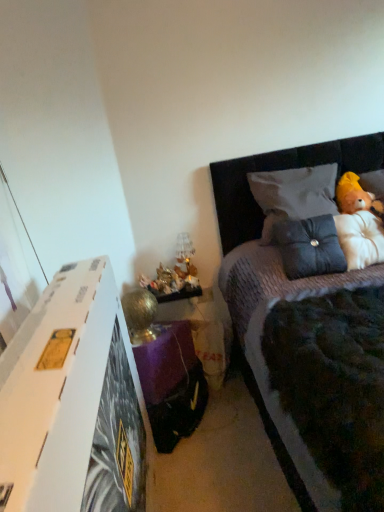
Question: From the image's perspective, is translucent glass lamp at lower center located beneath suede-like black pillow at upper right, which ranks as the second pillow in top-to-bottom order?

Choices:
 (A) yes
 (B) no

Answer: (A)

Question: Considering the relative sizes of translucent glass lamp at lower center and suede-like black pillow at upper right, which ranks as the second pillow in top-to-bottom order, in the image provided, is translucent glass lamp at lower center smaller than suede-like black pillow at upper right, which ranks as the second pillow in top-to-bottom order,?

Choices:
 (A) no
 (B) yes

Answer: (B)

Question: Does translucent glass lamp at lower center appear on the left side of suede-like black pillow at upper right, which ranks as the second pillow in top-to-bottom order?

Choices:
 (A) yes
 (B) no

Answer: (A)

Question: Can you confirm if translucent glass lamp at lower center is shorter than suede-like black pillow at upper right, which ranks as the second pillow in top-to-bottom order?

Choices:
 (A) yes
 (B) no

Answer: (A)

Question: Considering the relative sizes of translucent glass lamp at lower center and suede-like black pillow at upper right, positioned as the 1th pillow in bottom-to-top order, in the image provided, is translucent glass lamp at lower center wider than suede-like black pillow at upper right, positioned as the 1th pillow in bottom-to-top order,?

Choices:
 (A) yes
 (B) no

Answer: (B)

Question: Is translucent glass lamp at lower center facing towards suede-like black pillow at upper right, positioned as the 1th pillow in bottom-to-top order?

Choices:
 (A) yes
 (B) no

Answer: (B)

Question: Does velvet grey bed at upper right come in front of suede-like black pillow at upper right, positioned as the 1th pillow in bottom-to-top order?

Choices:
 (A) no
 (B) yes

Answer: (B)

Question: Does velvet grey bed at upper right have a smaller size compared to suede-like black pillow at upper right, positioned as the 1th pillow in bottom-to-top order?

Choices:
 (A) no
 (B) yes

Answer: (A)

Question: Is velvet grey bed at upper right positioned with its back to suede-like black pillow at upper right, positioned as the 1th pillow in bottom-to-top order?

Choices:
 (A) no
 (B) yes

Answer: (B)

Question: From a real-world perspective, is velvet grey bed at upper right located higher than suede-like black pillow at upper right, which ranks as the second pillow in top-to-bottom order?

Choices:
 (A) no
 (B) yes

Answer: (A)

Question: Could you tell me if velvet grey bed at upper right is turned towards suede-like black pillow at upper right, which ranks as the second pillow in top-to-bottom order?

Choices:
 (A) yes
 (B) no

Answer: (B)

Question: Is velvet grey bed at upper right bigger than suede-like black pillow at upper right, positioned as the 1th pillow in bottom-to-top order?

Choices:
 (A) yes
 (B) no

Answer: (A)

Question: From the image's perspective, is suede-like black pillow at upper right, positioned as the 1th pillow in bottom-to-top order, located above white cardboard at left?

Choices:
 (A) no
 (B) yes

Answer: (B)